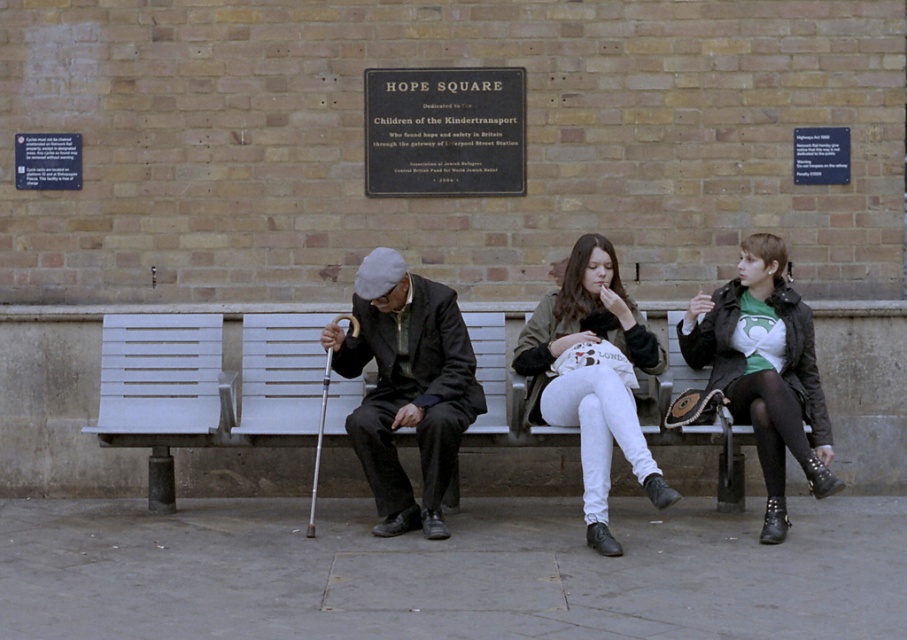
You are standing at the plaque in Hope Square and want to determine the relative positions of two points marked in the scene. Which point is closer to you, point (179, 385) or point (600, 268)?

Point (179, 385) is further to the viewer than point (600, 268), so the closer point to you is point (600, 268).